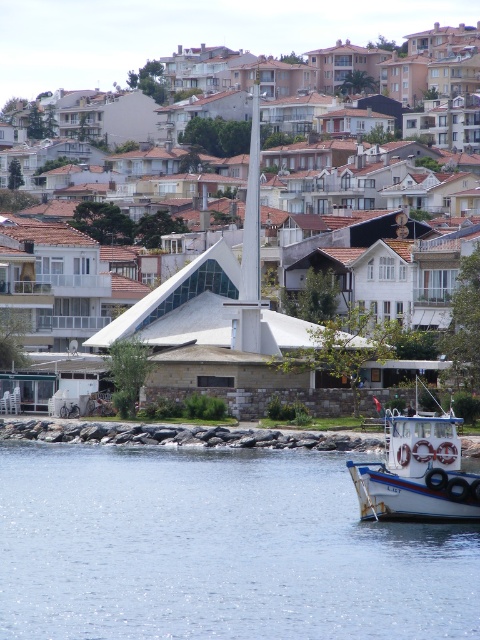
Question: Can you confirm if clear water at lower left is bigger than white plastic boat at lower right?

Choices:
 (A) yes
 (B) no

Answer: (A)

Question: Which object appears closest to the camera in this image?

Choices:
 (A) white plastic boat at lower right
 (B) clear water at lower left

Answer: (B)

Question: Which point is closer to the camera?

Choices:
 (A) clear water at lower left
 (B) white plastic boat at lower right

Answer: (A)

Question: Is clear water at lower left above white plastic boat at lower right?

Choices:
 (A) yes
 (B) no

Answer: (B)

Question: Can you confirm if clear water at lower left is positioned to the left of white plastic boat at lower right?

Choices:
 (A) no
 (B) yes

Answer: (B)